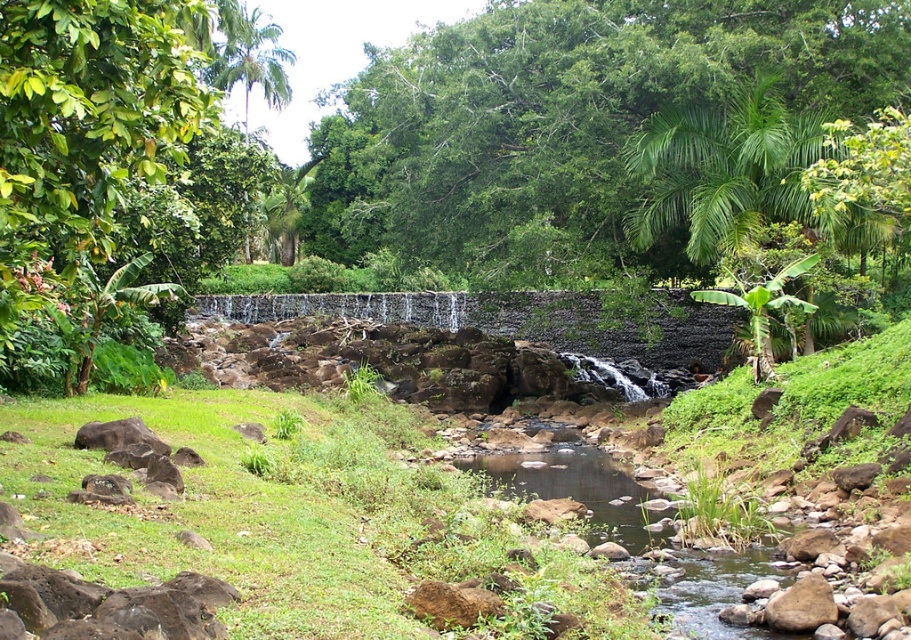
Question: Is green leafy tree at upper left positioned behind green leafy palm tree at upper left?

Choices:
 (A) yes
 (B) no

Answer: (B)

Question: Which point is farther to the camera?

Choices:
 (A) (285, 88)
 (B) (377, 307)
 (C) (681, 99)
 (D) (4, 365)

Answer: (A)

Question: Where is gray stone waterfall at center located in relation to green leafy palm tree at upper left in the image?

Choices:
 (A) right
 (B) left

Answer: (A)

Question: Estimate the real-world distances between objects in this image. Which object is farther from the green leafy tree at upper left?

Choices:
 (A) gray stone waterfall at center
 (B) green leafy palm tree at upper left

Answer: (B)

Question: Among these objects, which one is nearest to the camera?

Choices:
 (A) green leafy tree at upper center
 (B) green leafy tree at upper left

Answer: (B)

Question: Can you confirm if green leafy tree at upper center is bigger than gray stone waterfall at center?

Choices:
 (A) yes
 (B) no

Answer: (A)